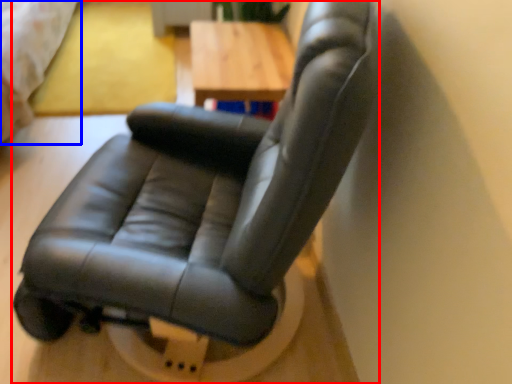
Question: Among these objects, which one is farthest to the camera, chair (highlighted by a red box) or bed (highlighted by a blue box)?

Choices:
 (A) chair
 (B) bed

Answer: (B)